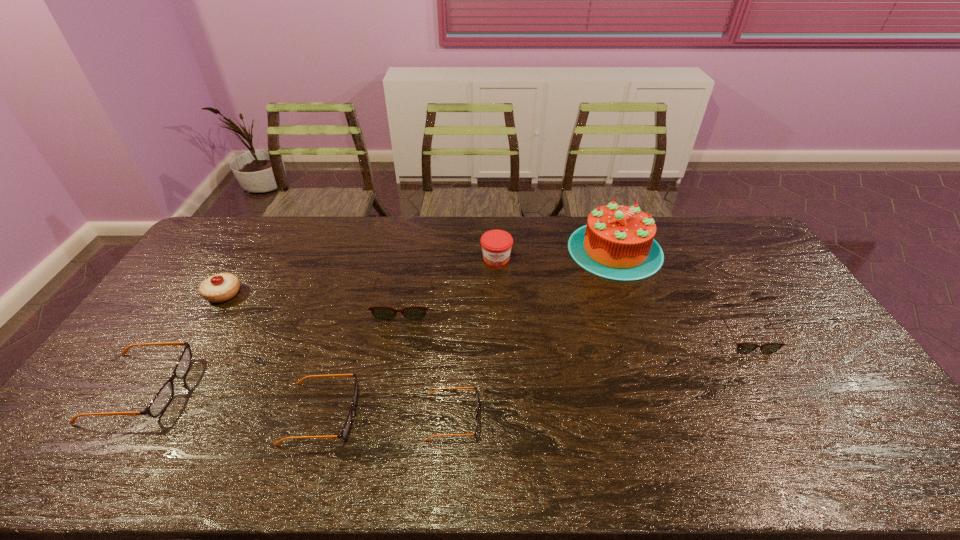
Image resolution: width=960 pixels, height=540 pixels. I want to click on the fourth nearest spectacles, so click(742, 348).

Where is `the smaller brown spectacles`? The height and width of the screenshot is (540, 960). the smaller brown spectacles is located at coordinates click(x=742, y=348).

Where is `the smallest black spectacles`? This screenshot has height=540, width=960. the smallest black spectacles is located at coordinates (476, 391).

The width and height of the screenshot is (960, 540). I want to click on the second spectacles from right to left, so click(x=476, y=391).

In order to click on free location located 0.330m on the right of the tallest object in this screenshot , I will do `click(752, 249)`.

Image resolution: width=960 pixels, height=540 pixels. I want to click on free space located 0.130m on the label side of the jam, so click(x=498, y=296).

Locate an element on the screen. vacant region located on the front of the beige pastry is located at coordinates (160, 396).

You are a GUI agent. You are given a task and a screenshot of the screen. Output one action in this format:
    pyautogui.click(x=<x>, y=<y>)
    Task: Click on the vacant region located at the front view of the farther brown spectacles
    Image resolution: width=960 pixels, height=540 pixels.
    Given the screenshot: What is the action you would take?
    pyautogui.click(x=392, y=373)

The height and width of the screenshot is (540, 960). I want to click on vacant space positioned 0.170m on the front-facing side of the leftmost spectacles, so click(246, 388).

The height and width of the screenshot is (540, 960). I want to click on free location located 0.340m on the front-facing side of the second black spectacles from left to right, so click(490, 414).